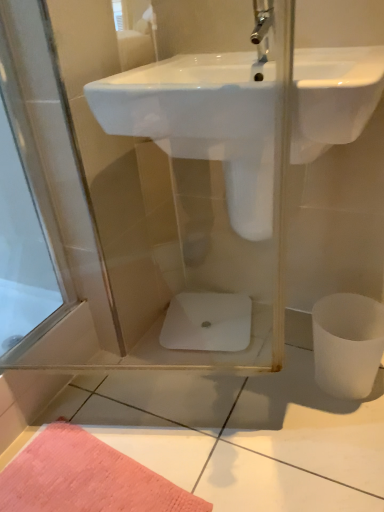
Question: Is white glossy toilet bowl at center, marked as the 2th toilet bowl in a front-to-back arrangement, bigger than white matte toilet bowl at lower right, marked as the 2th toilet bowl in a back-to-front arrangement?

Choices:
 (A) yes
 (B) no

Answer: (B)

Question: Is white glossy toilet bowl at center, the first toilet bowl when ordered from back to front, wider than white matte toilet bowl at lower right, which is counted as the 1th toilet bowl, starting from the front?

Choices:
 (A) yes
 (B) no

Answer: (A)

Question: From a real-world perspective, is white glossy toilet bowl at center, marked as the 2th toilet bowl in a front-to-back arrangement, located beneath white matte toilet bowl at lower right, which ranks as the 1th toilet bowl in right-to-left order?

Choices:
 (A) yes
 (B) no

Answer: (A)

Question: Can you confirm if white glossy toilet bowl at center, the first toilet bowl in the left-to-right sequence, is smaller than white matte toilet bowl at lower right, which is counted as the 1th toilet bowl, starting from the front?

Choices:
 (A) yes
 (B) no

Answer: (A)

Question: Considering the relative positions of white glossy toilet bowl at center, marked as the 2th toilet bowl in a front-to-back arrangement, and white matte toilet bowl at lower right, the second toilet bowl when ordered from left to right, in the image provided, is white glossy toilet bowl at center, marked as the 2th toilet bowl in a front-to-back arrangement, to the left of white matte toilet bowl at lower right, the second toilet bowl when ordered from left to right, from the viewer's perspective?

Choices:
 (A) no
 (B) yes

Answer: (B)

Question: Considering the positions of white glossy sink at center and white glossy toilet bowl at center, which is counted as the 2th toilet bowl, starting from the right, in the image, is white glossy sink at center bigger or smaller than white glossy toilet bowl at center, which is counted as the 2th toilet bowl, starting from the right,?

Choices:
 (A) small
 (B) big

Answer: (B)

Question: Does point (94, 108) appear closer or farther from the camera than point (180, 296)?

Choices:
 (A) farther
 (B) closer

Answer: (B)

Question: From the image's perspective, is white glossy sink at center located above or below white glossy toilet bowl at center, marked as the 2th toilet bowl in a front-to-back arrangement?

Choices:
 (A) below
 (B) above

Answer: (B)

Question: Is white glossy sink at center wider or thinner than white glossy toilet bowl at center, marked as the 2th toilet bowl in a front-to-back arrangement?

Choices:
 (A) thin
 (B) wide

Answer: (B)

Question: Do you think white glossy sink at center is within white matte toilet bowl at lower right, which ranks as the 1th toilet bowl in right-to-left order, or outside of it?

Choices:
 (A) inside
 (B) outside

Answer: (B)

Question: Is white glossy sink at center to the left or to the right of white matte toilet bowl at lower right, the second toilet bowl when ordered from left to right, in the image?

Choices:
 (A) right
 (B) left

Answer: (B)

Question: Is white glossy sink at center in front of or behind white matte toilet bowl at lower right, marked as the 2th toilet bowl in a back-to-front arrangement, in the image?

Choices:
 (A) behind
 (B) front

Answer: (B)

Question: Considering the positions of point (296, 61) and point (322, 345), is point (296, 61) closer or farther from the camera than point (322, 345)?

Choices:
 (A) farther
 (B) closer

Answer: (B)

Question: In terms of height, does white matte toilet bowl at lower right, which ranks as the 1th toilet bowl in right-to-left order, look taller or shorter compared to white glossy sink at center?

Choices:
 (A) short
 (B) tall

Answer: (B)

Question: Do you think white matte toilet bowl at lower right, which ranks as the 1th toilet bowl in right-to-left order, is within white glossy sink at center, or outside of it?

Choices:
 (A) inside
 (B) outside

Answer: (B)